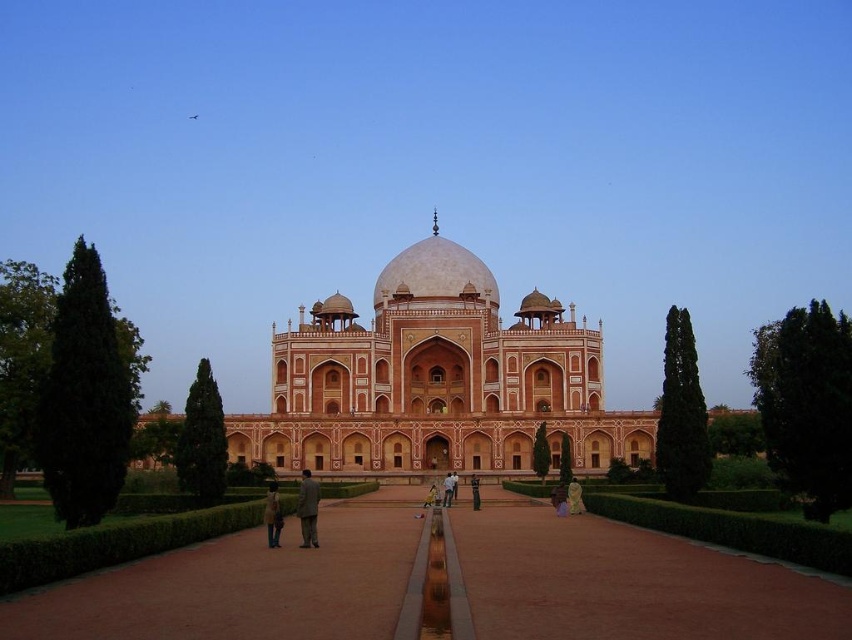
You are standing in front of the grand monument and notice two points marked on the ground. The first point is at coordinates point [306,532] and the second point is at point [263,518]. Which of these two points is nearer to your current position?

Point [306,532] is closer to the camera than point [263,518], so the first point is nearer to your current position.

You are a visitor standing in front of the monument and see the light brown fabric coat at center and the light green fabric at center. Which one is bigger in size?

The light brown fabric coat at center is larger in size compared to the light green fabric at center.